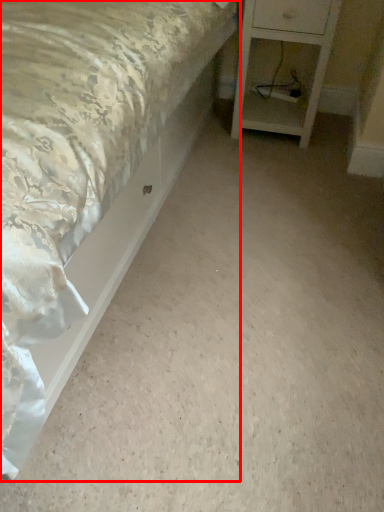
Question: From the image's perspective, where is bed (annotated by the red box) located relative to nightstand?

Choices:
 (A) below
 (B) above

Answer: (A)